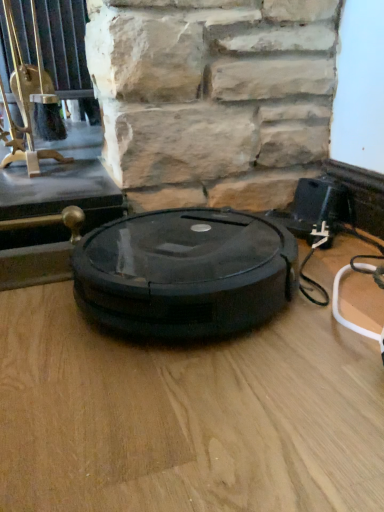
Identify the location of vacant space in front of black plastic robot vacuum cleaner at center. The height and width of the screenshot is (512, 384). (192, 409).